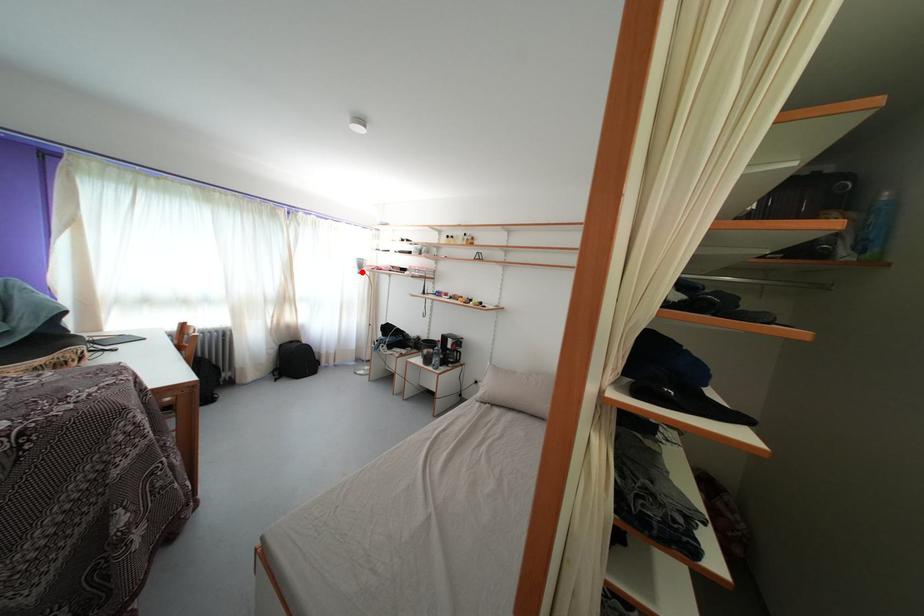
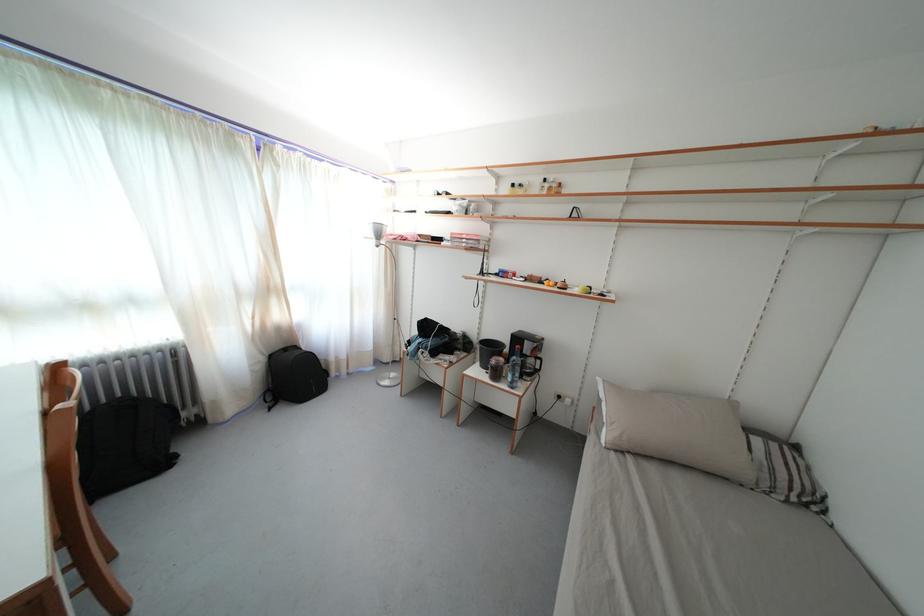
The point at the highlighted location is marked in the first image. Where is the corresponding point in the second image?

(378, 241)